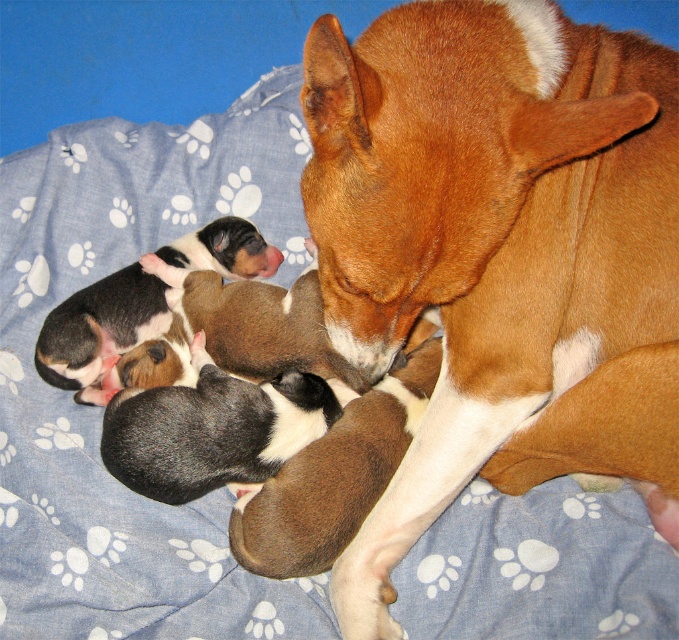
Question: Which object is the closest to the black and white fur puppies at lower left?

Choices:
 (A) black and white fur at center
 (B) brown smooth dog at center

Answer: (A)

Question: Which point is closer to the camera?

Choices:
 (A) brown smooth dog at center
 (B) black and white fur at center
 (C) black and white fur puppies at lower left

Answer: (A)

Question: Can you confirm if black and white fur at center is bigger than black and white fur puppies at lower left?

Choices:
 (A) no
 (B) yes

Answer: (A)

Question: Does black and white fur at center have a larger size compared to black and white fur puppies at lower left?

Choices:
 (A) no
 (B) yes

Answer: (A)

Question: Can you confirm if black and white fur at center is positioned below black and white fur puppies at lower left?

Choices:
 (A) yes
 (B) no

Answer: (A)

Question: Which object is the closest to the black and white fur puppies at lower left?

Choices:
 (A) black and white fur at center
 (B) brown smooth dog at center

Answer: (A)